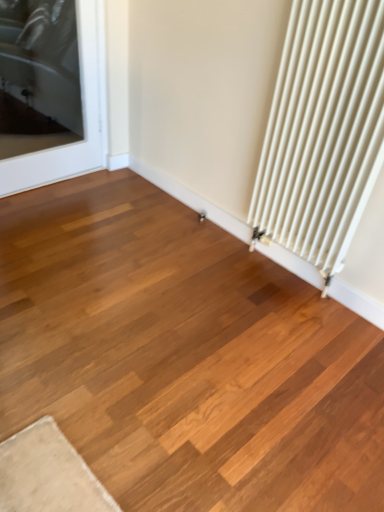
The width and height of the screenshot is (384, 512). What are the coordinates of `vacant space situated on the left part of white matte radiator at right` in the screenshot? It's located at (218, 266).